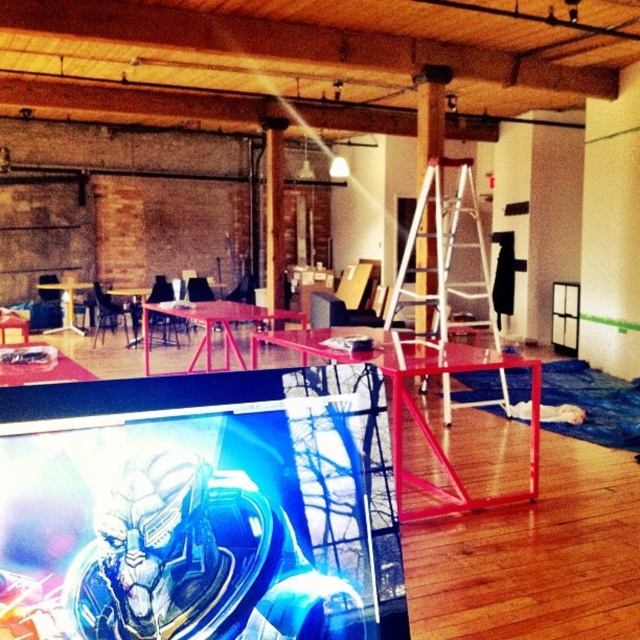
You are an event planner setting up for a party. You need to hang a banner that requires a tall structure. Based on the scene, which object between the white metal ladder at center and the white glossy pillar at center is taller and can support the banner?

The white metal ladder at center is taller than the white glossy pillar at center, so the banner can be hung on the white metal ladder at center.

You are setting up a display in the room and need to place a new item between the white metal ladder at center and the white glossy pillar at center. Based on their positions, which object should you place the item closer to if you want it nearer to the ladder?

The item should be placed closer to the white metal ladder at center because it is already positioned to the right of the white glossy pillar at center, so placing it near the ladder would mean it is closer to the ladder.